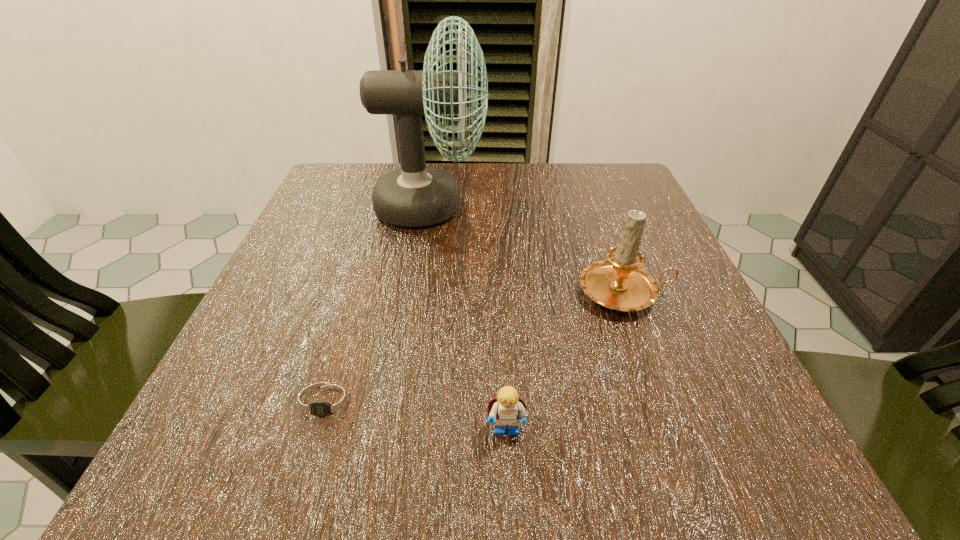
Locate an element on the screen. This screenshot has width=960, height=540. free space at the right edge of the desktop is located at coordinates click(736, 385).

Image resolution: width=960 pixels, height=540 pixels. I want to click on vacant position at the far left corner of the desktop, so click(336, 170).

Identify the location of vacant space at the near left corner. (232, 443).

The height and width of the screenshot is (540, 960). In the image, there is a desktop. In order to click on free region at the far right corner in this screenshot , I will do pos(626,180).

Identify the location of free location at the near right corner of the desktop. (661, 469).

Where is `blank region between the watch and the tallest object`? Image resolution: width=960 pixels, height=540 pixels. blank region between the watch and the tallest object is located at coordinates (379, 304).

In order to click on free space between the rightmost object and the tallest object in this screenshot , I will do `click(528, 249)`.

Identify the location of vacant area that lies between the fan and the third nearest object. (528, 249).

Locate an element on the screen. free area in between the watch and the Lego is located at coordinates (418, 417).

I want to click on free space that is in between the shortest object and the fan, so click(x=379, y=304).